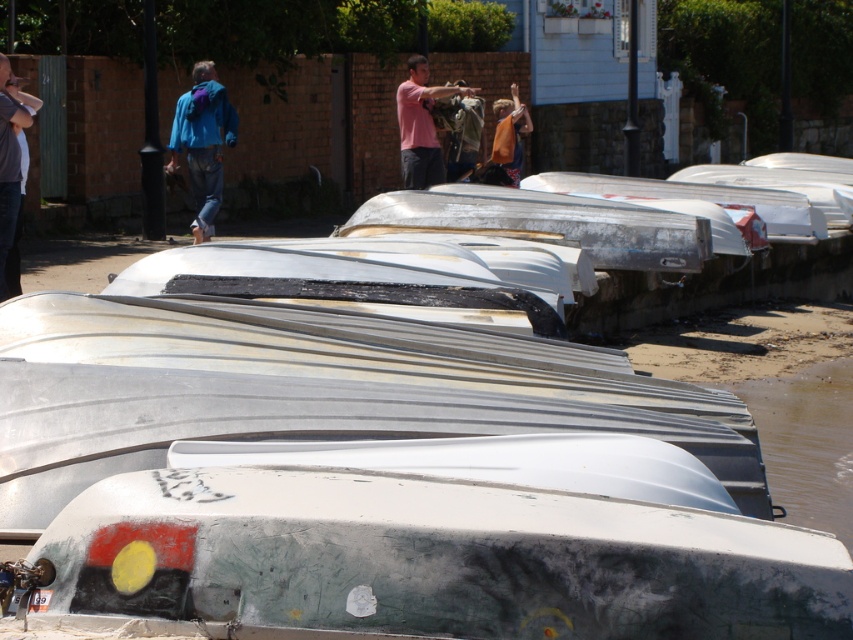
Is pink matte shirt at center above orange fabric bag at center?

No.

Does pink matte shirt at center come in front of orange fabric bag at center?

Yes, it is in front of orange fabric bag at center.

Is point (407, 161) positioned behind point (514, 177)?

No, (407, 161) is closer to viewer.

You are a GUI agent. You are given a task and a screenshot of the screen. Output one action in this format:
    pyautogui.click(x=<x>, y=<y>)
    Task: Click on the pink matte shirt at center
    Image resolution: width=853 pixels, height=640 pixels.
    Given the screenshot: What is the action you would take?
    pyautogui.click(x=421, y=124)

Who is higher up, brushed metal jacket at upper left or orange fabric bag at center?

orange fabric bag at center is higher up.

Which is in front, point (3, 259) or point (508, 141)?

Point (3, 259)

In order to click on brushed metal jacket at upper left in this screenshot , I will do `click(10, 164)`.

Is point (213, 83) farther from viewer compared to point (463, 141)?

No, it is in front of (463, 141).

Does matte blue jacket at left have a lesser height compared to matte black jacket at center?

No, matte blue jacket at left is not shorter than matte black jacket at center.

Between point (192, 152) and point (469, 100), which one is positioned behind?

Point (469, 100)

You are a GUI agent. You are given a task and a screenshot of the screen. Output one action in this format:
    pyautogui.click(x=<x>, y=<y>)
    Task: Click on the matte blue jacket at left
    
    Given the screenshot: What is the action you would take?
    pyautogui.click(x=202, y=141)